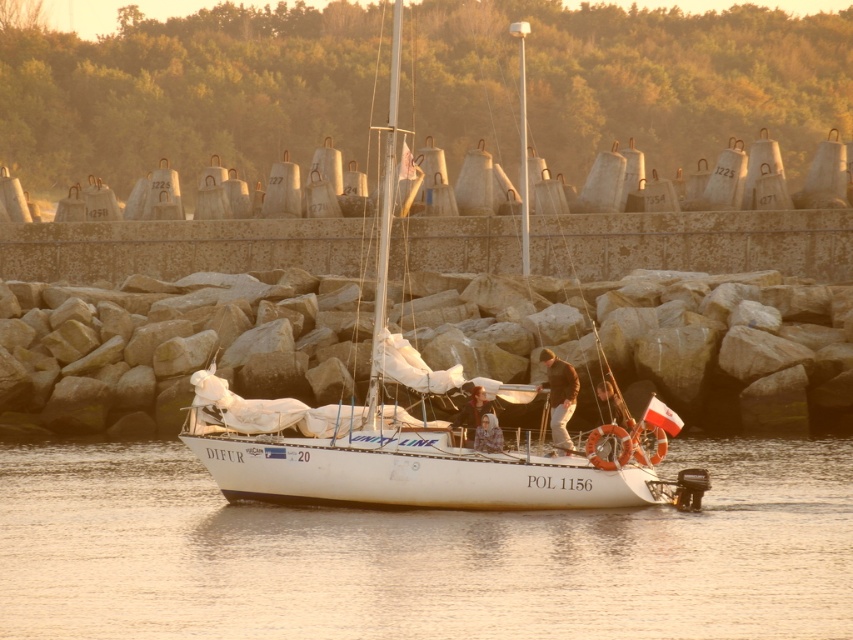
You are standing at the edge of the breakwater and want to reach the two points marked on the image. Which point, point (750, 544) or point (497, 422), is closer to you?

Point (750, 544) is closer to the viewer than point (497, 422).

You are an observer standing on the rocky breakwater. You notice the white glossy water at center and the white matte sailboat at center. Which object takes up more space in the image?

The white matte sailboat at center takes up more space in the image than the white glossy water at center because the white glossy water at center occupies less space than the white matte sailboat at center.